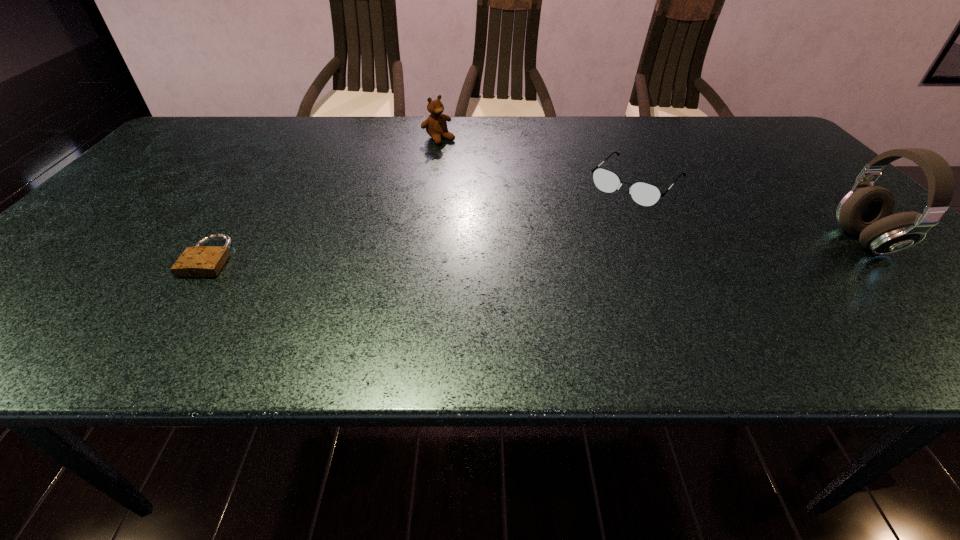
Identify the location of free space on the desktop that is between the leftmost object and the rightmost object and is positioned on the lenses of the second shortest object. Image resolution: width=960 pixels, height=540 pixels. (574, 248).

The image size is (960, 540). What are the coordinates of `vacant space on the desktop that is between the shortest object and the rightmost object and is positioned at the face of the second tallest object` in the screenshot? It's located at (588, 248).